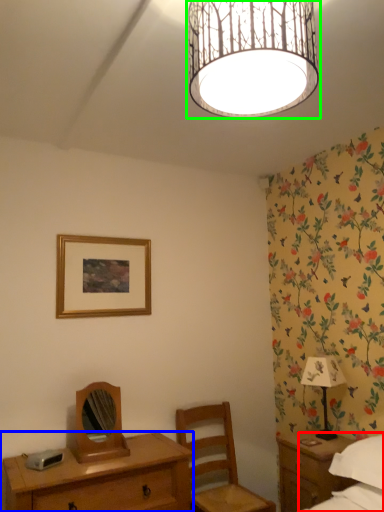
Question: Which is farther away from bed (highlighted by a red box)? desk (highlighted by a blue box) or lamp (highlighted by a green box)?

Choices:
 (A) desk
 (B) lamp

Answer: (B)